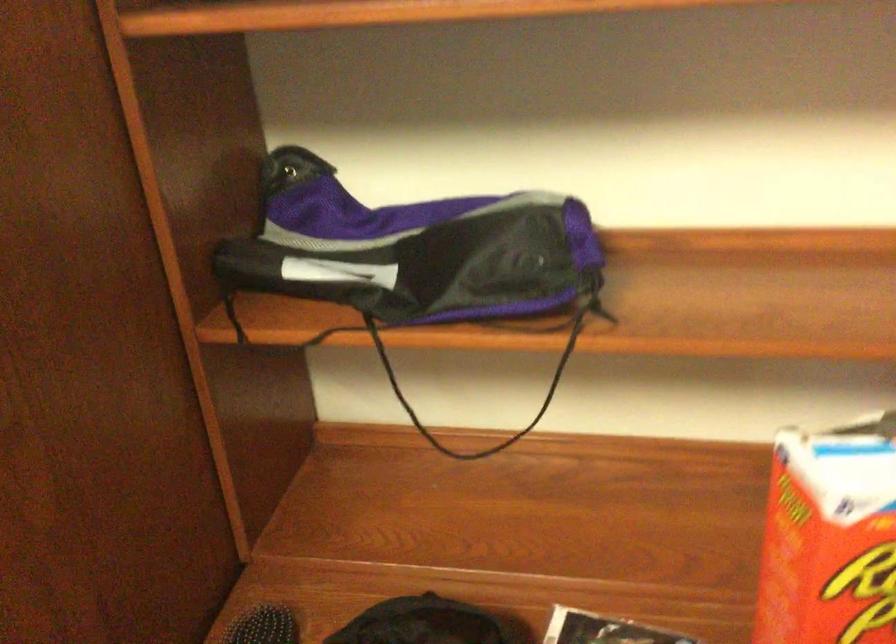
This screenshot has height=644, width=896. What do you see at coordinates (419, 623) in the screenshot? I see `a black bag drawstring` at bounding box center [419, 623].